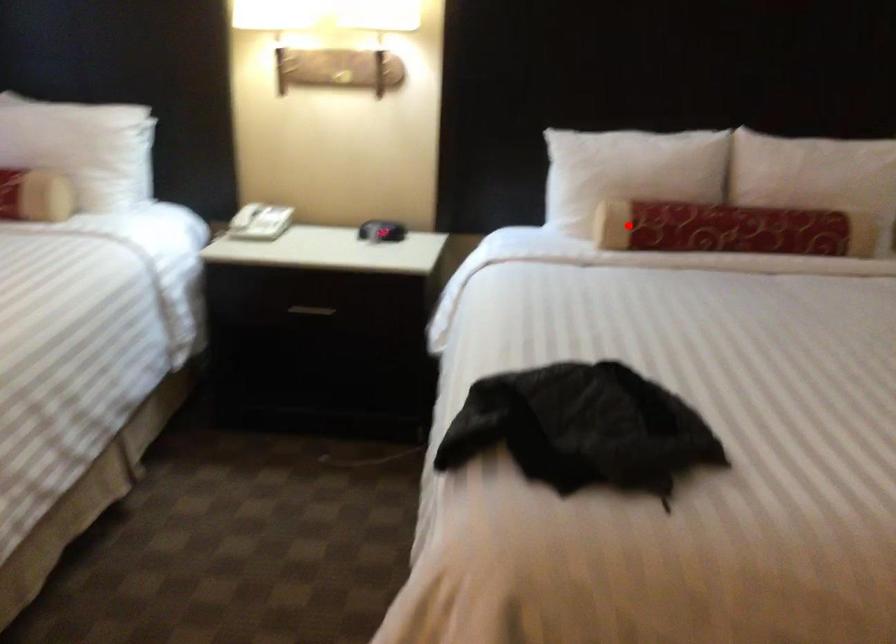
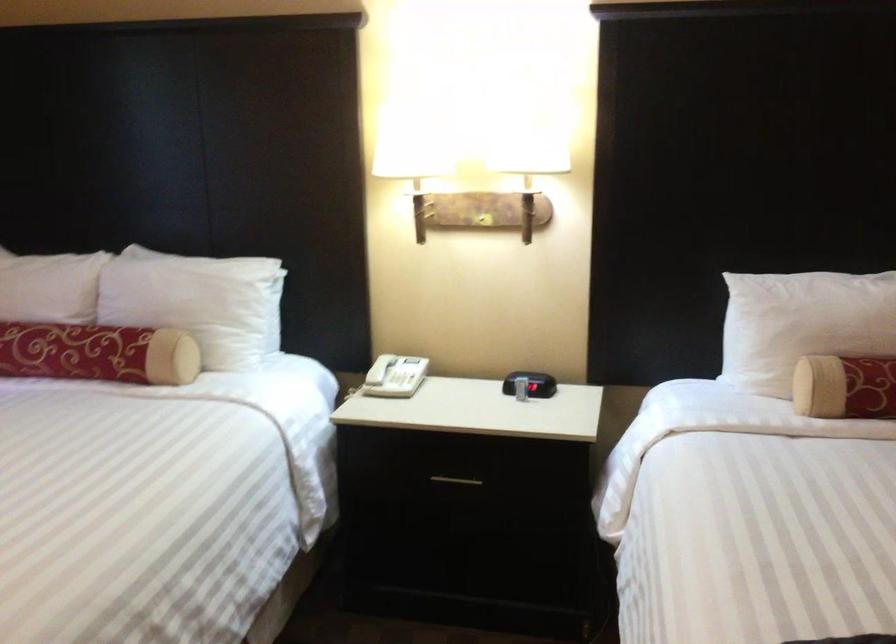
Question: I am providing you with two images of the same scene from different viewpoints. In image1, a red point is highlighted. Considering the same 3D point in image2, which of the following is correct?

Choices:
 (A) It is closer
 (B) It is farther

Answer: (A)